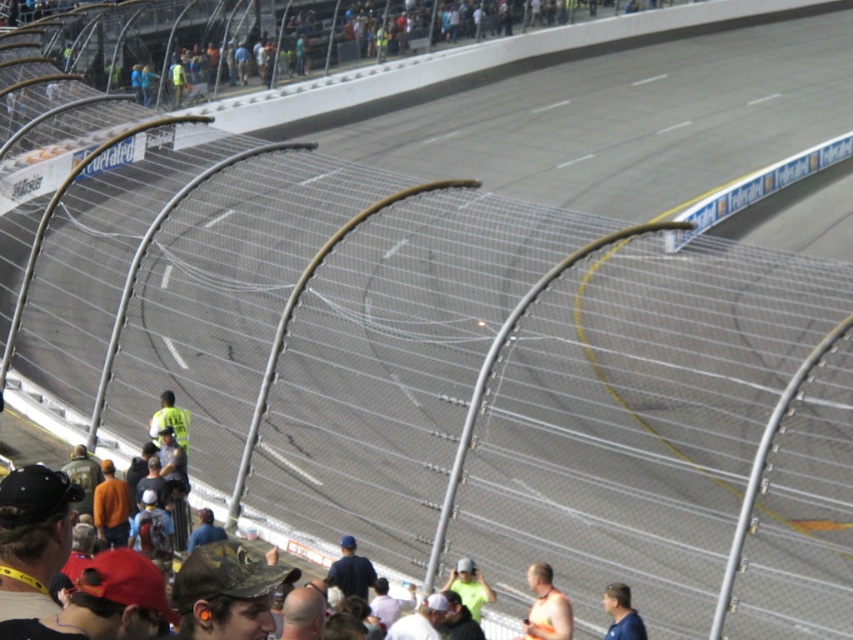
Question: Which object is farther from the camera taking this photo?

Choices:
 (A) orange reflective vest at center
 (B) green fabric cap at center
 (C) blue shirt at lower center

Answer: (B)

Question: Can you confirm if orange reflective vest at center is positioned above blue shirt at lower center?

Choices:
 (A) yes
 (B) no

Answer: (B)

Question: Which point is farther from the camera taking this photo?

Choices:
 (A) (625, 627)
 (B) (474, 611)

Answer: (B)

Question: Estimate the real-world distances between objects in this image. Which object is farther from the orange reflective vest at center?

Choices:
 (A) blue shirt at lower center
 (B) green fabric cap at center

Answer: (B)

Question: Can you confirm if blue shirt at lower center is positioned to the right of green fabric cap at center?

Choices:
 (A) no
 (B) yes

Answer: (B)

Question: Can you confirm if orange reflective vest at center is positioned to the right of blue shirt at lower center?

Choices:
 (A) yes
 (B) no

Answer: (B)